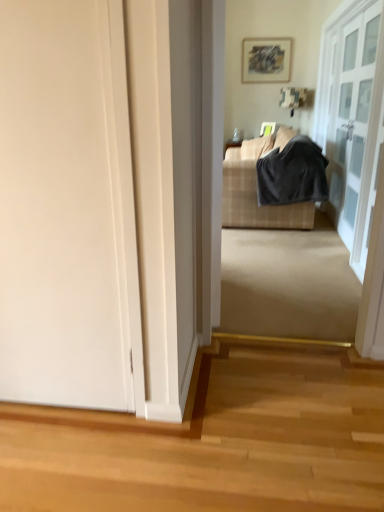
Question: Can you confirm if plaid fabric couch at center is smaller than matte gray picture frame at upper center?

Choices:
 (A) no
 (B) yes

Answer: (A)

Question: From a real-world perspective, is plaid fabric couch at center on top of matte gray picture frame at upper center?

Choices:
 (A) no
 (B) yes

Answer: (A)

Question: Can you confirm if plaid fabric couch at center is shorter than matte gray picture frame at upper center?

Choices:
 (A) no
 (B) yes

Answer: (A)

Question: Does plaid fabric couch at center turn towards matte gray picture frame at upper center?

Choices:
 (A) no
 (B) yes

Answer: (A)

Question: Is plaid fabric couch at center turned away from matte gray picture frame at upper center?

Choices:
 (A) yes
 (B) no

Answer: (B)

Question: Is point (340, 64) closer or farther from the camera than point (241, 170)?

Choices:
 (A) closer
 (B) farther

Answer: (B)

Question: From a real-world perspective, is clear glass door at upper right, the second door positioned from the left, physically located above or below plaid fabric couch at center?

Choices:
 (A) below
 (B) above

Answer: (B)

Question: Considering the positions of clear glass door at upper right, the second door positioned from the left, and plaid fabric couch at center in the image, is clear glass door at upper right, the second door positioned from the left, taller or shorter than plaid fabric couch at center?

Choices:
 (A) short
 (B) tall

Answer: (B)

Question: Relative to plaid fabric couch at center, is clear glass door at upper right, which is the first door in back-to-front order, in front or behind?

Choices:
 (A) behind
 (B) front

Answer: (B)

Question: Is white matte door at left, which is counted as the 2th door, starting from the back, bigger or smaller than clear glass door at upper right, which appears as the 2th door when viewed from the front?

Choices:
 (A) small
 (B) big

Answer: (B)

Question: Based on their positions, is white matte door at left, the first door positioned from the front, located to the left or right of clear glass door at upper right, which is the first door in back-to-front order?

Choices:
 (A) left
 (B) right

Answer: (A)

Question: Is white matte door at left, the 2th door in the right-to-left sequence, wider or thinner than clear glass door at upper right, which appears as the 2th door when viewed from the front?

Choices:
 (A) thin
 (B) wide

Answer: (B)

Question: From a real-world perspective, is white matte door at left, the first door positioned from the front, positioned above or below clear glass door at upper right, which appears as the 2th door when viewed from the front?

Choices:
 (A) above
 (B) below

Answer: (B)

Question: Is point (283, 223) closer or farther from the camera than point (380, 97)?

Choices:
 (A) closer
 (B) farther

Answer: (B)

Question: Is plaid fabric couch at center wider or thinner than clear glass door at upper right, the second door positioned from the left?

Choices:
 (A) thin
 (B) wide

Answer: (B)